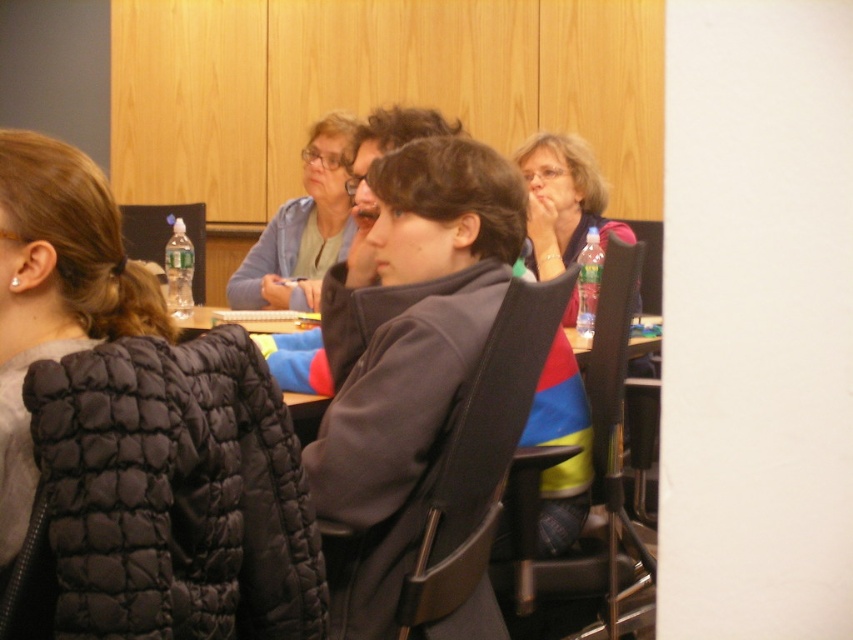
You are standing at point [286,228] and want to walk to point [149,600]. Is the point you want to reach in front of you?

Yes, the point [149,600] is in front of point [286,228], so it is in front of you.

You are standing in the conference room and see the black quilted jacket at lower left and the matte blue sweater at upper center. Which one is positioned lower in the image?

The black quilted jacket at lower left is positioned lower than the matte blue sweater at upper center according to the description.